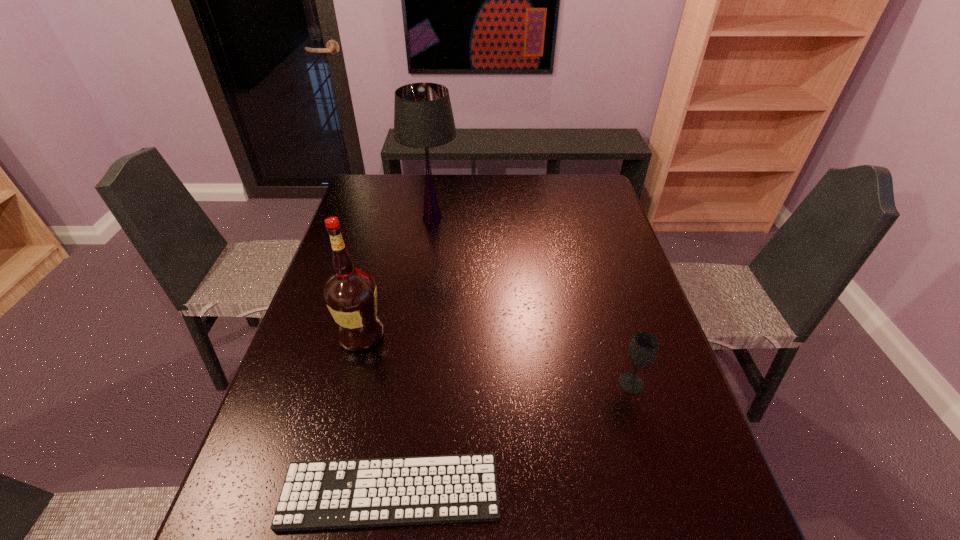
Identify the location of free space between the shortest object and the third farthest object. (511, 437).

At what (x,y) coordinates should I click in order to perform the action: click on vacant space that is in between the farthest object and the alcohol. Please return your answer as a coordinate pair (x, y). Looking at the image, I should click on (396, 276).

Find the location of `blank region between the third shortest object and the farthest object`. blank region between the third shortest object and the farthest object is located at coordinates (396, 276).

Locate an element on the screen. The image size is (960, 540). free spot between the second nearest object and the tallest object is located at coordinates (532, 301).

The width and height of the screenshot is (960, 540). I want to click on vacant point located between the nearest object and the rightmost object, so click(511, 437).

Locate an element on the screen. empty space between the third farthest object and the nearest object is located at coordinates (511, 437).

I want to click on blank region between the tallest object and the third shortest object, so click(396, 276).

Locate an element on the screen. The width and height of the screenshot is (960, 540). vacant space that is in between the farthest object and the rightmost object is located at coordinates (532, 301).

In order to click on free space that is in between the rightmost object and the second tallest object in this screenshot , I will do `click(496, 359)`.

Locate an element on the screen. The height and width of the screenshot is (540, 960). free spot between the wineglass and the computer keyboard is located at coordinates (511, 437).